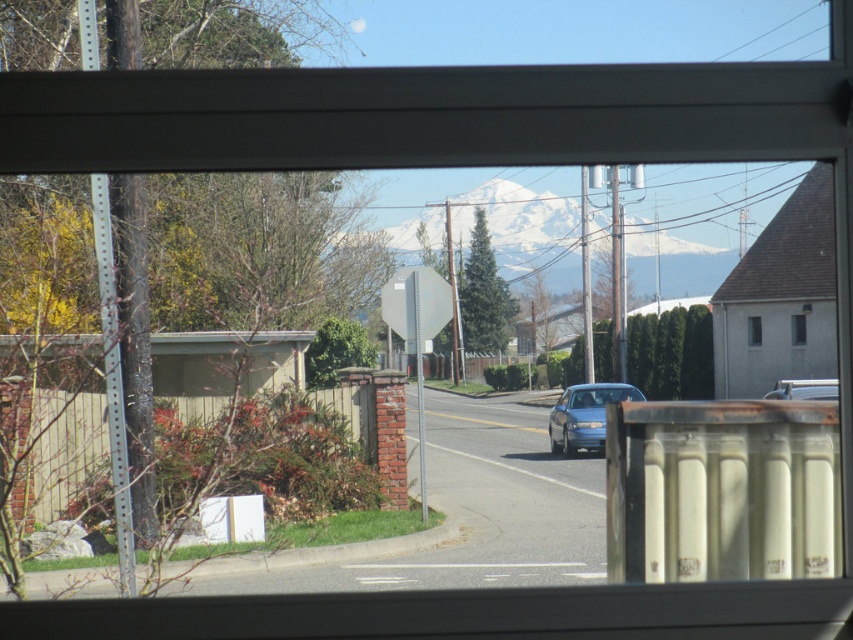
In the scene shown: You are a pedestrian standing at the edge of the road. You see the metallic gray stop sign at center and the metallic silver car at center. How far apart are they from each other?

The metallic gray stop sign at center and the metallic silver car at center are 6.31 meters apart.

You are driving a car and see the metallic gray stop sign at center and the metallic silver car at center through the window. Which object is closer to you?

The metallic gray stop sign at center is closer to you because the metallic silver car at center is behind it.